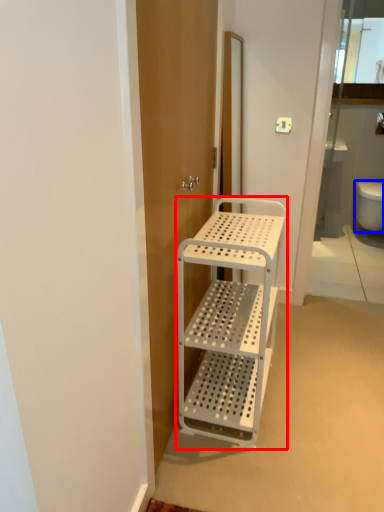
Question: Which object is closer to the camera taking this photo, furniture (highlighted by a red box) or toilet bowl (highlighted by a blue box)?

Choices:
 (A) furniture
 (B) toilet bowl

Answer: (A)